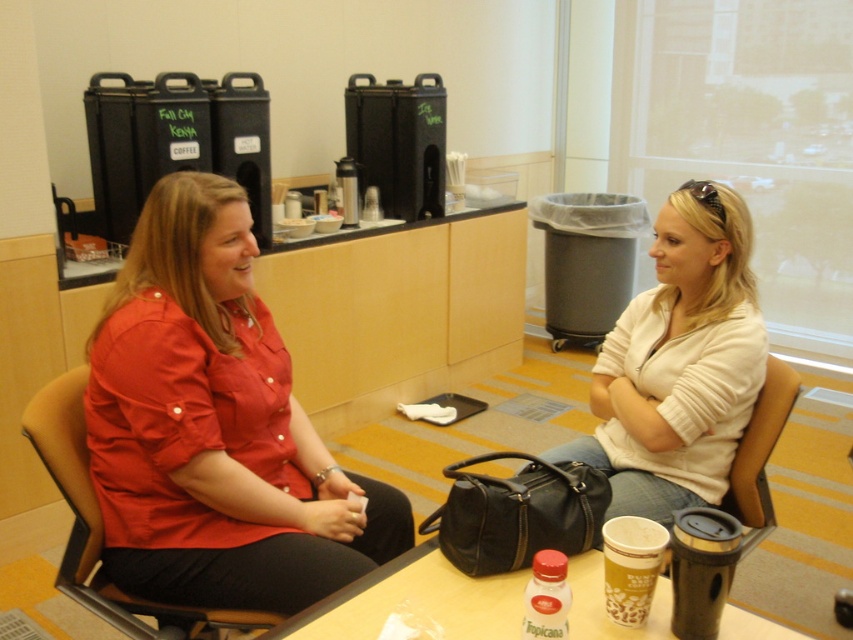
You are a delivery person who needs to place a large package on the table. The package is the same size as the brown leather chair at left. Can the matte plastic table at center hold the package?

The matte plastic table at center has a smaller size compared to the brown leather chair at left. Since the package is the same size as the brown leather chair at left, the table is too small to accommodate the package.

You are a delivery person who needs to place a package on the matte plastic table at center. However, there is a brown paper cup at lower center on the table. Can the package be placed on the table without knocking over the cup?

The matte plastic table at center is not as tall as brown paper cup at lower center, so the height of the table may not be sufficient to support the package safely. Ensure the cup is moved before placing the package.